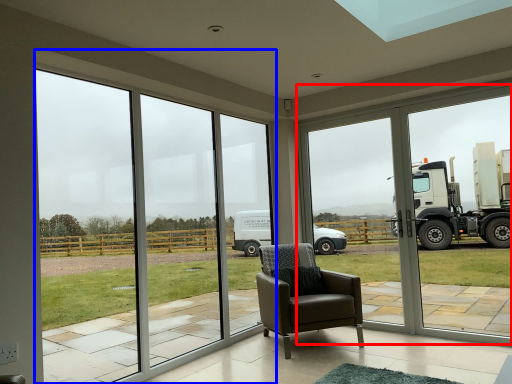
Question: Which of the following is the closest to the observer, window frame (highlighted by a red box) or window (highlighted by a blue box)?

Choices:
 (A) window frame
 (B) window

Answer: (B)